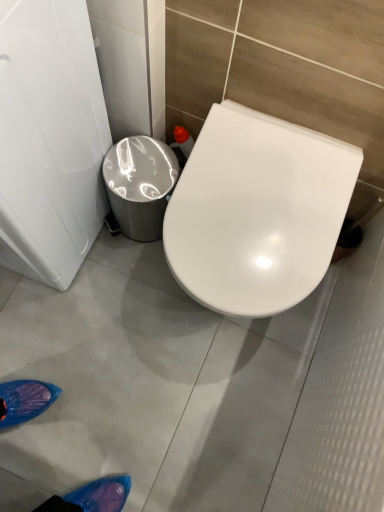
Question: Considering the positions of shiny metallic trash can at center left and white glossy toilet seat at center in the image, is shiny metallic trash can at center left taller or shorter than white glossy toilet seat at center?

Choices:
 (A) tall
 (B) short

Answer: (B)

Question: From the image's perspective, is shiny metallic trash can at center left positioned above or below white glossy toilet seat at center?

Choices:
 (A) above
 (B) below

Answer: (A)

Question: In terms of size, does shiny metallic trash can at center left appear bigger or smaller than white glossy toilet seat at center?

Choices:
 (A) big
 (B) small

Answer: (B)

Question: Is white glossy toilet seat at center taller or shorter than shiny metallic trash can at center left?

Choices:
 (A) short
 (B) tall

Answer: (B)

Question: In terms of size, does white glossy toilet seat at center appear bigger or smaller than shiny metallic trash can at center left?

Choices:
 (A) small
 (B) big

Answer: (B)

Question: From a real-world perspective, is white glossy toilet seat at center positioned above or below shiny metallic trash can at center left?

Choices:
 (A) below
 (B) above

Answer: (B)

Question: Is white glossy toilet seat at center in front of or behind shiny metallic trash can at center left in the image?

Choices:
 (A) behind
 (B) front

Answer: (B)